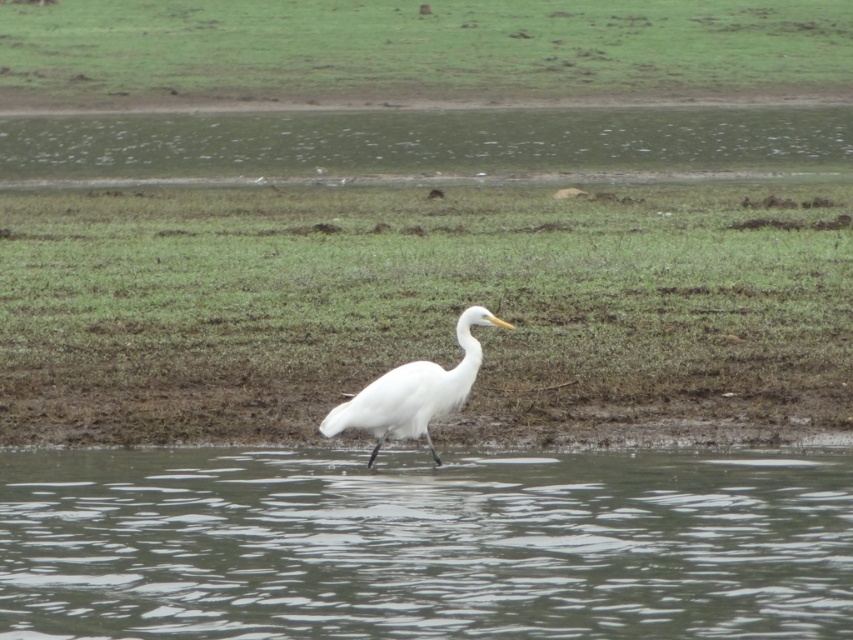
The width and height of the screenshot is (853, 640). What are the coordinates of `clear water at lower center` in the screenshot? It's located at (422, 544).

Is point (722, 500) behind point (401, 422)?

Yes, point (722, 500) is behind point (401, 422).

Locate an element on the screen. clear water at lower center is located at coordinates (422, 544).

Measure the distance between green grass at center and camera.

green grass at center is 7.90 meters away from camera.

Does green grass at center appear on the right side of green grass at upper center?

→ Yes, green grass at center is to the right of green grass at upper center.

Between point (279, 221) and point (735, 17), which one is positioned in front?

Point (279, 221) is in front.

Locate an element on the screen. green grass at center is located at coordinates (422, 308).

Is green grass at center taller than white feathered bird at center?

Yes.

Does point (532, 300) lie behind point (474, 346)?

Yes, point (532, 300) is behind point (474, 346).

Where is `green grass at center`? The height and width of the screenshot is (640, 853). green grass at center is located at coordinates (422, 308).